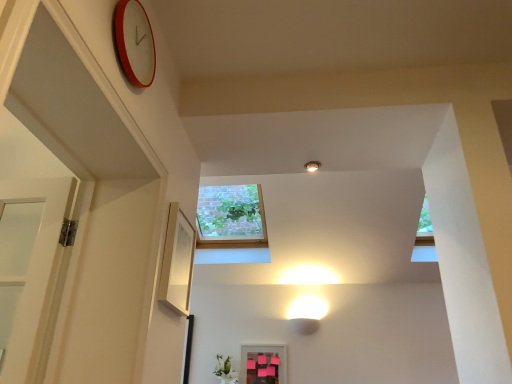
The width and height of the screenshot is (512, 384). What do you see at coordinates (225, 370) in the screenshot? I see `green matte vase at lower center` at bounding box center [225, 370].

At what (x,y) coordinates should I click in order to perform the action: click on matte white picture frame at center-left, the 1th picture frame when ordered from left to right. Please return your answer as a coordinate pair (x, y). Image resolution: width=512 pixels, height=384 pixels. Looking at the image, I should click on (177, 261).

Find the location of a particular element. red plastic clock at upper left is located at coordinates (134, 43).

In order to face red plastic clock at upper left, should I rotate leftwards or rightwards?

It's best to rotate left around 15.445 degrees.

From the picture: In order to face pink matte picture frame at lower center, which is counted as the first picture frame, starting from the right, should I rotate leftwards or rightwards?

A 0.860 degree turn to the right will do.

Describe the element at coordinates (312, 166) in the screenshot. I see `white glossy light fixture at upper center` at that location.

This screenshot has height=384, width=512. I want to click on green matte vase at lower center, so click(225, 370).

Which is behind, point (215, 369) or point (150, 64)?

Positioned behind is point (215, 369).

From a real-world perspective, which is physically below, green matte vase at lower center or red plastic clock at upper left?

green matte vase at lower center is physically lower.

Would you say green matte vase at lower center is to the left or to the right of red plastic clock at upper left in the picture?

Clearly, green matte vase at lower center is on the right of red plastic clock at upper left in the image.

Does green matte vase at lower center lie in front of red plastic clock at upper left?

No, it is not.

Which object is more forward, white glossy light fixture at upper center or red plastic clock at upper left?

red plastic clock at upper left is more forward.

Is white glossy light fixture at upper center facing towards red plastic clock at upper left?

No.

Does white glossy light fixture at upper center have a smaller size compared to red plastic clock at upper left?

Yes, white glossy light fixture at upper center is smaller than red plastic clock at upper left.

Based on the photo, would you say white glossy light fixture at upper center contains red plastic clock at upper left?

Actually, red plastic clock at upper left is outside white glossy light fixture at upper center.

From the image's perspective, relative to matte white picture frame at center-left, arranged as the 2th picture frame when viewed from the back, is red plastic clock at upper left above or below?

Clearly, from the image's perspective, red plastic clock at upper left is above matte white picture frame at center-left, arranged as the 2th picture frame when viewed from the back.

Which is in front, point (136, 38) or point (192, 253)?

Positioned in front is point (136, 38).

Does red plastic clock at upper left touch matte white picture frame at center-left, which is counted as the 2th picture frame, starting from the bottom?

No, red plastic clock at upper left is not making contact with matte white picture frame at center-left, which is counted as the 2th picture frame, starting from the bottom.

Is red plastic clock at upper left to the left or to the right of matte white picture frame at center-left, arranged as the 2th picture frame when viewed from the back, in the image?

red plastic clock at upper left is to the left of matte white picture frame at center-left, arranged as the 2th picture frame when viewed from the back.

Does point (182, 280) appear closer or farther from the camera than point (304, 166)?

Clearly, point (182, 280) is closer to the camera than point (304, 166).

Based on their sizes in the image, would you say matte white picture frame at center-left, the 1th picture frame when ordered from left to right, is bigger or smaller than white glossy light fixture at upper center?

In the image, matte white picture frame at center-left, the 1th picture frame when ordered from left to right, appears to be larger than white glossy light fixture at upper center.

From a real-world perspective, is matte white picture frame at center-left, the 1th picture frame when ordered from left to right, under white glossy light fixture at upper center?

Correct, in the physical world, matte white picture frame at center-left, the 1th picture frame when ordered from left to right, is lower than white glossy light fixture at upper center.

Looking at their sizes, would you say matte white picture frame at center-left, which is the second picture frame from right to left, is wider or thinner than white glossy light fixture at upper center?

Clearly, matte white picture frame at center-left, which is the second picture frame from right to left, has less width compared to white glossy light fixture at upper center.

From the image's perspective, is pink matte picture frame at lower center, which ranks as the first picture frame in back-to-front order, above matte white picture frame at center-left, marked as the 1th picture frame in a front-to-back arrangement?

Incorrect, from the image's perspective, pink matte picture frame at lower center, which ranks as the first picture frame in back-to-front order, is lower than matte white picture frame at center-left, marked as the 1th picture frame in a front-to-back arrangement.

Which of these two, pink matte picture frame at lower center, which appears as the 2th picture frame when viewed from the front, or matte white picture frame at center-left, arranged as the 2th picture frame when viewed from the back, stands shorter?

With less height is matte white picture frame at center-left, arranged as the 2th picture frame when viewed from the back.

Between pink matte picture frame at lower center, the 2th picture frame positioned from the left, and matte white picture frame at center-left, which is the first picture frame from top to bottom, which one appears on the right side from the viewer's perspective?

Positioned to the right is pink matte picture frame at lower center, the 2th picture frame positioned from the left.

Is pink matte picture frame at lower center, arranged as the 1th picture frame when ordered from the bottom, next to matte white picture frame at center-left, arranged as the 2th picture frame when viewed from the back, and touching it?

pink matte picture frame at lower center, arranged as the 1th picture frame when ordered from the bottom, and matte white picture frame at center-left, arranged as the 2th picture frame when viewed from the back, are clearly separated.

Is pink matte picture frame at lower center, the 2th picture frame from the top, bigger or smaller than white glossy light fixture at upper center?

pink matte picture frame at lower center, the 2th picture frame from the top, is bigger than white glossy light fixture at upper center.

Is pink matte picture frame at lower center, the 2th picture frame from the top, positioned beyond the bounds of white glossy light fixture at upper center?

Yes.

From the image's perspective, is pink matte picture frame at lower center, which is counted as the first picture frame, starting from the right, over white glossy light fixture at upper center?

No, from the image's perspective, pink matte picture frame at lower center, which is counted as the first picture frame, starting from the right, is not on top of white glossy light fixture at upper center.

Considering the relative sizes of pink matte picture frame at lower center, the 2th picture frame from the top, and white glossy light fixture at upper center in the image provided, is pink matte picture frame at lower center, the 2th picture frame from the top, wider than white glossy light fixture at upper center?

Incorrect, the width of pink matte picture frame at lower center, the 2th picture frame from the top, does not surpass that of white glossy light fixture at upper center.

Which object is thinner, matte white picture frame at center-left, which is the second picture frame from right to left, or pink matte picture frame at lower center, the 2th picture frame positioned from the left?

With smaller width is pink matte picture frame at lower center, the 2th picture frame positioned from the left.

In terms of height, does matte white picture frame at center-left, which is the second picture frame from right to left, look taller or shorter compared to pink matte picture frame at lower center, the 2th picture frame from the top?

In the image, matte white picture frame at center-left, which is the second picture frame from right to left, appears to be shorter than pink matte picture frame at lower center, the 2th picture frame from the top.

Consider the image. Considering the relative sizes of matte white picture frame at center-left, which is the second picture frame from right to left, and pink matte picture frame at lower center, which appears as the 2th picture frame when viewed from the front, in the image provided, is matte white picture frame at center-left, which is the second picture frame from right to left, bigger than pink matte picture frame at lower center, which appears as the 2th picture frame when viewed from the front,?

Incorrect, matte white picture frame at center-left, which is the second picture frame from right to left, is not larger than pink matte picture frame at lower center, which appears as the 2th picture frame when viewed from the front.

How many degrees apart are the facing directions of matte white picture frame at center-left, which is counted as the 2th picture frame, starting from the bottom, and pink matte picture frame at lower center, which is counted as the first picture frame, starting from the right?

They differ by 88.6 degrees in their facing directions.

I want to click on clock above the green matte vase at lower center (from the image's perspective), so click(x=134, y=43).

Find the location of `clock below the white glossy light fixture at upper center (from a real-world perspective)`. clock below the white glossy light fixture at upper center (from a real-world perspective) is located at coordinates (134, 43).

Based on their spatial positions, is matte white picture frame at center-left, arranged as the 2th picture frame when viewed from the back, or pink matte picture frame at lower center, the 2th picture frame positioned from the left, closer to red plastic clock at upper left?

matte white picture frame at center-left, arranged as the 2th picture frame when viewed from the back, lies closer to red plastic clock at upper left than the other object.

From the image, which object appears to be farther from pink matte picture frame at lower center, the 2th picture frame from the top, matte white picture frame at center-left, which is the second picture frame from right to left, or white glossy light fixture at upper center?

matte white picture frame at center-left, which is the second picture frame from right to left, is positioned further to the anchor pink matte picture frame at lower center, the 2th picture frame from the top.

Estimate the real-world distances between objects in this image. Which object is closer to matte white picture frame at center-left, the 1th picture frame when ordered from left to right, pink matte picture frame at lower center, which appears as the 2th picture frame when viewed from the front, or green matte vase at lower center?

green matte vase at lower center is closer to matte white picture frame at center-left, the 1th picture frame when ordered from left to right.

Estimate the real-world distances between objects in this image. Which object is closer to green matte vase at lower center, white glossy light fixture at upper center or red plastic clock at upper left?

white glossy light fixture at upper center.

Estimate the real-world distances between objects in this image. Which object is further from white glossy light fixture at upper center, matte white picture frame at center-left, which is the second picture frame from right to left, or green matte vase at lower center?

Based on the image, green matte vase at lower center appears to be further to white glossy light fixture at upper center.

Based on their spatial positions, is green matte vase at lower center or white glossy light fixture at upper center further from matte white picture frame at center-left, marked as the 1th picture frame in a front-to-back arrangement?

Based on the image, green matte vase at lower center appears to be further to matte white picture frame at center-left, marked as the 1th picture frame in a front-to-back arrangement.

From the image, which object appears to be farther from green matte vase at lower center, red plastic clock at upper left or pink matte picture frame at lower center, which appears as the 2th picture frame when viewed from the front?

red plastic clock at upper left lies further to green matte vase at lower center than the other object.

Looking at the image, which one is located further to red plastic clock at upper left, white glossy light fixture at upper center or matte white picture frame at center-left, which is the second picture frame from right to left?

white glossy light fixture at upper center is positioned further to the anchor red plastic clock at upper left.

Where is `plant that lies between white glossy light fixture at upper center and pink matte picture frame at lower center, which is counted as the first picture frame, starting from the right, from top to bottom`? This screenshot has height=384, width=512. plant that lies between white glossy light fixture at upper center and pink matte picture frame at lower center, which is counted as the first picture frame, starting from the right, from top to bottom is located at coordinates (225, 370).

The image size is (512, 384). Identify the location of light fixture between matte white picture frame at center-left, which is counted as the 2th picture frame, starting from the bottom, and pink matte picture frame at lower center, arranged as the 1th picture frame when ordered from the bottom, from front to back. (312, 166).

Where is `plant between matte white picture frame at center-left, the 1th picture frame when ordered from left to right, and pink matte picture frame at lower center, which ranks as the first picture frame in back-to-front order, from front to back`? Image resolution: width=512 pixels, height=384 pixels. plant between matte white picture frame at center-left, the 1th picture frame when ordered from left to right, and pink matte picture frame at lower center, which ranks as the first picture frame in back-to-front order, from front to back is located at coordinates (225, 370).

At what (x,y) coordinates should I click in order to perform the action: click on picture frame between red plastic clock at upper left and white glossy light fixture at upper center in the front-back direction. Please return your answer as a coordinate pair (x, y). Looking at the image, I should click on (177, 261).